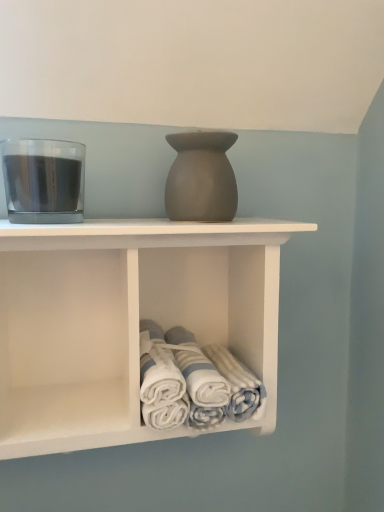
Question: Should I look upward or downward to see white cotton towels at lower center?

Choices:
 (A) down
 (B) up

Answer: (A)

Question: Is transparent glass at left surrounding white matte towel rack at center?

Choices:
 (A) yes
 (B) no

Answer: (B)

Question: From a real-world perspective, does transparent glass at left sit lower than white matte towel rack at center?

Choices:
 (A) yes
 (B) no

Answer: (B)

Question: Is there a large distance between transparent glass at left and white matte towel rack at center?

Choices:
 (A) no
 (B) yes

Answer: (A)

Question: Can you confirm if transparent glass at left is wider than white matte towel rack at center?

Choices:
 (A) yes
 (B) no

Answer: (B)

Question: From the image's perspective, is transparent glass at left beneath white matte towel rack at center?

Choices:
 (A) yes
 (B) no

Answer: (B)

Question: Is transparent glass at left further to the viewer compared to white matte towel rack at center?

Choices:
 (A) yes
 (B) no

Answer: (A)

Question: Is white cotton towels at lower center placed right next to matte gray vase at center?

Choices:
 (A) yes
 (B) no

Answer: (B)

Question: Is white cotton towels at lower center at the right side of matte gray vase at center?

Choices:
 (A) no
 (B) yes

Answer: (B)

Question: Does white cotton towels at lower center come in front of matte gray vase at center?

Choices:
 (A) no
 (B) yes

Answer: (B)

Question: Is matte gray vase at center surrounded by white cotton towels at lower center?

Choices:
 (A) no
 (B) yes

Answer: (A)

Question: From the image's perspective, would you say white cotton towels at lower center is positioned over matte gray vase at center?

Choices:
 (A) yes
 (B) no

Answer: (B)

Question: From the image's perspective, does white cotton towels at lower center appear lower than matte gray vase at center?

Choices:
 (A) yes
 (B) no

Answer: (A)

Question: From a real-world perspective, is white cotton towels at lower center on top of transparent glass at left?

Choices:
 (A) yes
 (B) no

Answer: (B)